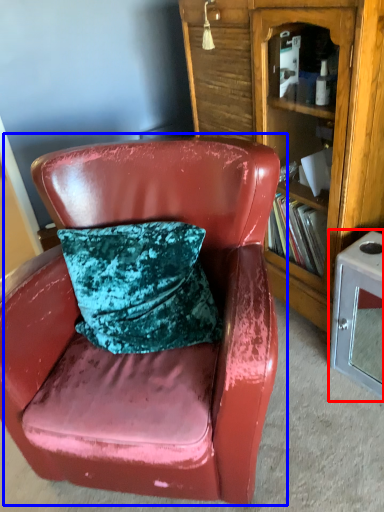
Question: Which object is closer to the camera taking this photo, table (highlighted by a red box) or chair (highlighted by a blue box)?

Choices:
 (A) table
 (B) chair

Answer: (B)